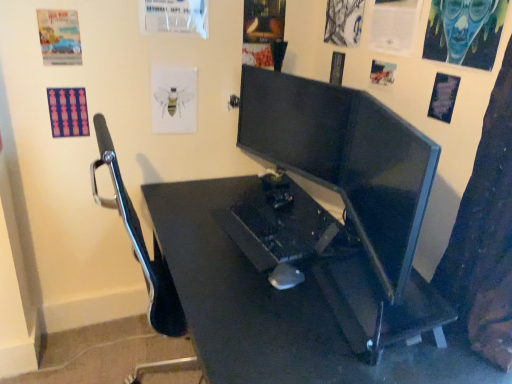
Find the location of `free spot to the right of black plastic mouse at center`. free spot to the right of black plastic mouse at center is located at coordinates (318, 282).